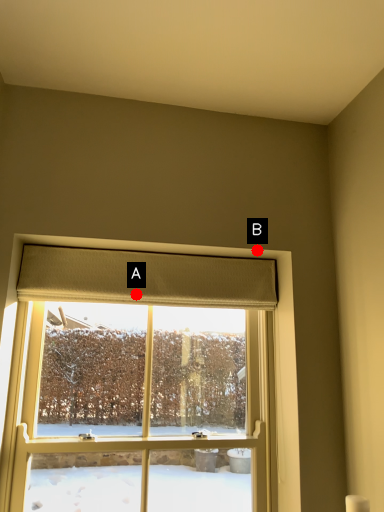
Question: Two points are circled on the image, labeled by A and B beside each circle. Which point is farther to the camera?

Choices:
 (A) A is further
 (B) B is further

Answer: (A)